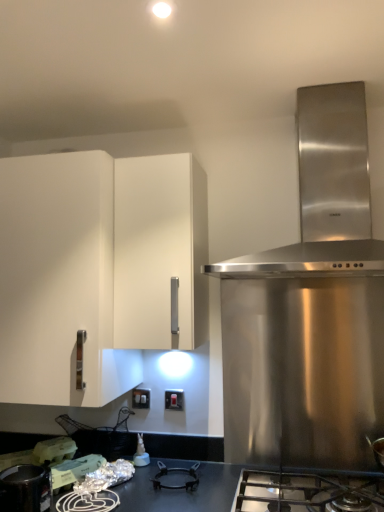
Question: Does white matte plastic container at lower left turn towards stainless steel gas stove at lower center?

Choices:
 (A) no
 (B) yes

Answer: (A)

Question: Considering the relative sizes of white matte plastic container at lower left and stainless steel gas stove at lower center in the image provided, is white matte plastic container at lower left wider than stainless steel gas stove at lower center?

Choices:
 (A) yes
 (B) no

Answer: (B)

Question: Is white matte plastic container at lower left in contact with stainless steel gas stove at lower center?

Choices:
 (A) yes
 (B) no

Answer: (B)

Question: Is white matte plastic container at lower left shorter than stainless steel gas stove at lower center?

Choices:
 (A) no
 (B) yes

Answer: (B)

Question: Does white matte plastic container at lower left contain stainless steel gas stove at lower center?

Choices:
 (A) no
 (B) yes

Answer: (A)

Question: From the image's perspective, relative to stainless steel gas stove at lower center, is white plastic switch at lower center, the second electric outlet in the left-to-right sequence, above or below?

Choices:
 (A) above
 (B) below

Answer: (A)

Question: Considering the relative positions of white plastic switch at lower center, the second electric outlet in the left-to-right sequence, and stainless steel gas stove at lower center in the image provided, is white plastic switch at lower center, the second electric outlet in the left-to-right sequence, to the left or to the right of stainless steel gas stove at lower center?

Choices:
 (A) left
 (B) right

Answer: (A)

Question: In terms of height, does white plastic switch at lower center, the second electric outlet in the left-to-right sequence, look taller or shorter compared to stainless steel gas stove at lower center?

Choices:
 (A) tall
 (B) short

Answer: (B)

Question: Considering the positions of point (165, 391) and point (349, 498), is point (165, 391) closer or farther from the camera than point (349, 498)?

Choices:
 (A) farther
 (B) closer

Answer: (A)

Question: Considering the positions of point (26, 298) and point (165, 399), is point (26, 298) closer or farther from the camera than point (165, 399)?

Choices:
 (A) farther
 (B) closer

Answer: (B)

Question: Considering their positions, is white matte cabinet at left located in front of or behind white plastic switch at lower center, the 1th electric outlet when ordered from right to left?

Choices:
 (A) front
 (B) behind

Answer: (A)

Question: In terms of size, does white matte cabinet at left appear bigger or smaller than white plastic switch at lower center, the 1th electric outlet when ordered from right to left?

Choices:
 (A) small
 (B) big

Answer: (B)

Question: Based on their positions, is white matte cabinet at left located to the left or right of white plastic switch at lower center, the 1th electric outlet when ordered from right to left?

Choices:
 (A) right
 (B) left

Answer: (B)

Question: Considering the positions of stainless steel gas stove at lower center and white matte plastic container at lower left in the image, is stainless steel gas stove at lower center taller or shorter than white matte plastic container at lower left?

Choices:
 (A) tall
 (B) short

Answer: (A)

Question: Is stainless steel gas stove at lower center inside the boundaries of white matte plastic container at lower left, or outside?

Choices:
 (A) outside
 (B) inside

Answer: (A)